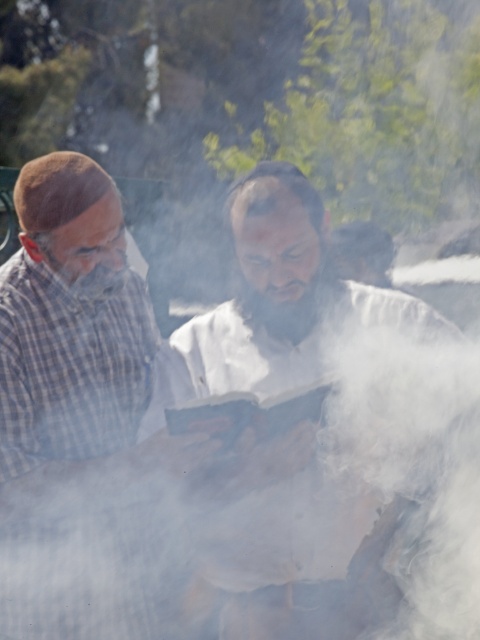
Question: Is white matte book at center further to the viewer compared to plaid fabric shirt at left?

Choices:
 (A) yes
 (B) no

Answer: (B)

Question: Does white matte book at center have a lesser width compared to plaid fabric shirt at left?

Choices:
 (A) no
 (B) yes

Answer: (A)

Question: Which object is closer to the camera taking this photo?

Choices:
 (A) plaid fabric shirt at left
 (B) white matte book at center

Answer: (B)

Question: Can you confirm if white matte book at center is bigger than plaid fabric shirt at left?

Choices:
 (A) yes
 (B) no

Answer: (A)